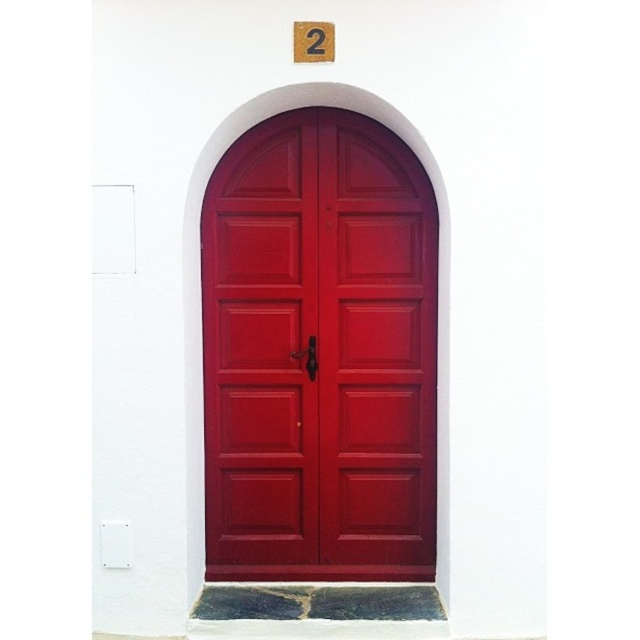
From the picture: Can you confirm if matte wood door at center is positioned above wooden number at upper center?

Actually, matte wood door at center is below wooden number at upper center.

Is matte wood door at center smaller than wooden number at upper center?

Incorrect, matte wood door at center is not smaller in size than wooden number at upper center.

Where is `matte wood door at center`? The width and height of the screenshot is (640, 640). matte wood door at center is located at coordinates (320, 353).